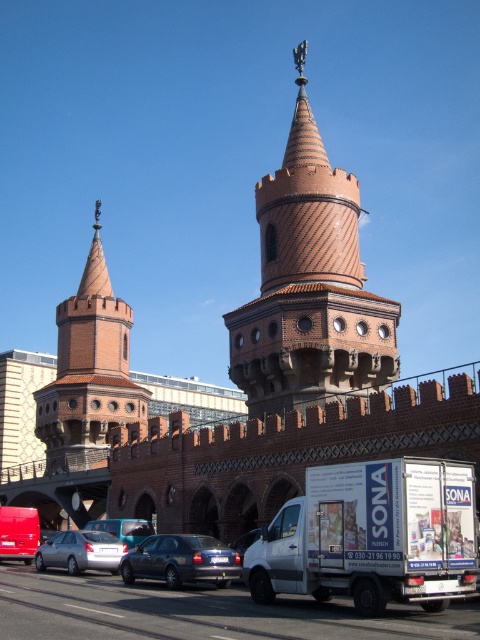
You are standing at the base of the red brick structure and want to take a photo of the point at coordinates point [314,380]. The camera you have can focus on objects up to 50 meters away. Will the point be in focus?

The distance of point [314,380] from viewer is 52.75 meters, which is beyond the camera focus limit of 50 meters. The point will not be in focus.

You are standing at the point marked by the coordinates (x=310, y=285) in the image. What architectural feature are you directly at?

The point at coordinates (x=310, y=285) corresponds to the brown textured tower at center, so you are directly at the brown textured tower at center.

You are a pedestrian standing on the busy street and want to take a photo of the brown textured tower at center. However, there is a matte red van at lower left blocking your view. Can you see the entire tower from your current position?

The matte red van at lower left is behind the brown textured tower at center, so the van is not blocking the view of the tower. You can see the entire tower from your current position.